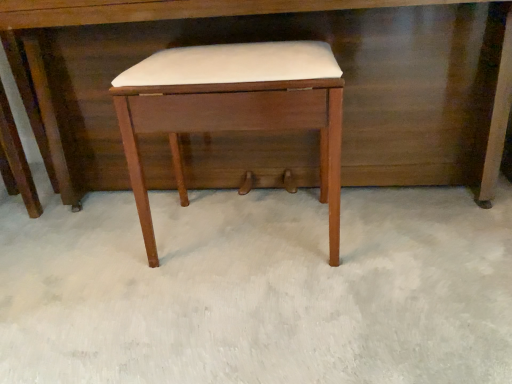
Question: Is wooden desk at center thinner than white leather stool at center?

Choices:
 (A) no
 (B) yes

Answer: (A)

Question: Does wooden desk at center have a greater height compared to white leather stool at center?

Choices:
 (A) no
 (B) yes

Answer: (B)

Question: Is wooden desk at center positioned in front of white leather stool at center?

Choices:
 (A) no
 (B) yes

Answer: (A)

Question: Does wooden desk at center have a smaller size compared to white leather stool at center?

Choices:
 (A) no
 (B) yes

Answer: (A)

Question: Does wooden desk at center turn towards white leather stool at center?

Choices:
 (A) no
 (B) yes

Answer: (B)

Question: Is wooden desk at center with white leather stool at center?

Choices:
 (A) no
 (B) yes

Answer: (A)

Question: Does white leather stool at center appear on the right side of wooden desk at center?

Choices:
 (A) yes
 (B) no

Answer: (B)

Question: Considering the relative sizes of white leather stool at center and wooden desk at center in the image provided, is white leather stool at center shorter than wooden desk at center?

Choices:
 (A) no
 (B) yes

Answer: (B)

Question: Is wooden desk at center inside white leather stool at center?

Choices:
 (A) no
 (B) yes

Answer: (A)

Question: Is white leather stool at center with wooden desk at center?

Choices:
 (A) no
 (B) yes

Answer: (A)

Question: Is white leather stool at center in front of wooden desk at center?

Choices:
 (A) yes
 (B) no

Answer: (A)

Question: Is white leather stool at center far away from wooden desk at center?

Choices:
 (A) no
 (B) yes

Answer: (A)

Question: Is point (493, 185) closer or farther from the camera than point (317, 117)?

Choices:
 (A) farther
 (B) closer

Answer: (A)